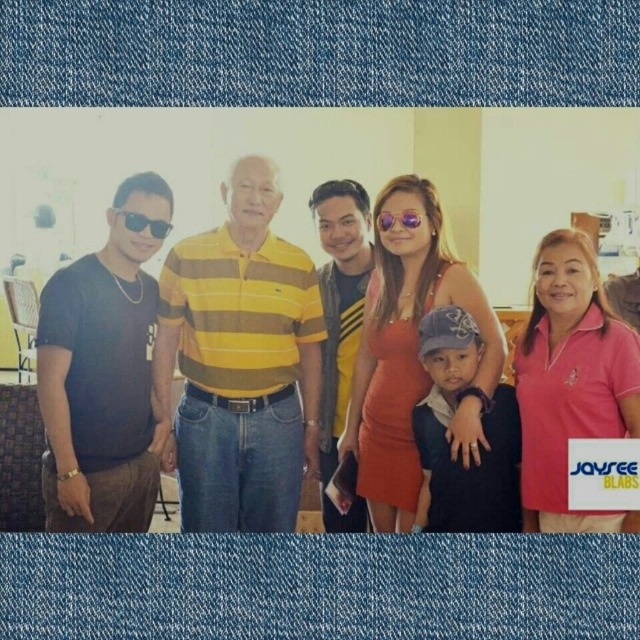
Which is above, matte yellow striped polo shirt at center or sunglasses at center?

sunglasses at center

Does point (278, 275) come closer to viewer compared to point (417, 218)?

No, it is behind (417, 218).

Does point (180, 433) come behind point (401, 218)?

Yes, it is behind point (401, 218).

Find the location of a particular element. This screenshot has width=640, height=640. matte yellow striped polo shirt at center is located at coordinates (129, 458).

Is matte yellow striped polo shirt at center above matte black sunglasses at left?

Incorrect, matte yellow striped polo shirt at center is not positioned above matte black sunglasses at left.

Is matte yellow striped polo shirt at center below matte black sunglasses at left?

Yes, matte yellow striped polo shirt at center is below matte black sunglasses at left.

Between point (262, 474) and point (138, 216), which one is positioned behind?

Positioned behind is point (262, 474).

Identify the location of matte yellow striped polo shirt at center. Image resolution: width=640 pixels, height=640 pixels. (129, 458).

Can you confirm if matte black sunglasses at left is thinner than sunglasses at center?

No.

Does matte black sunglasses at left have a greater width compared to sunglasses at center?

Indeed, matte black sunglasses at left has a greater width compared to sunglasses at center.

Is point (147, 224) farther from camera compared to point (378, 225)?

No, (147, 224) is closer to viewer.

Locate an element on the screen. The width and height of the screenshot is (640, 640). matte black sunglasses at left is located at coordinates (144, 224).